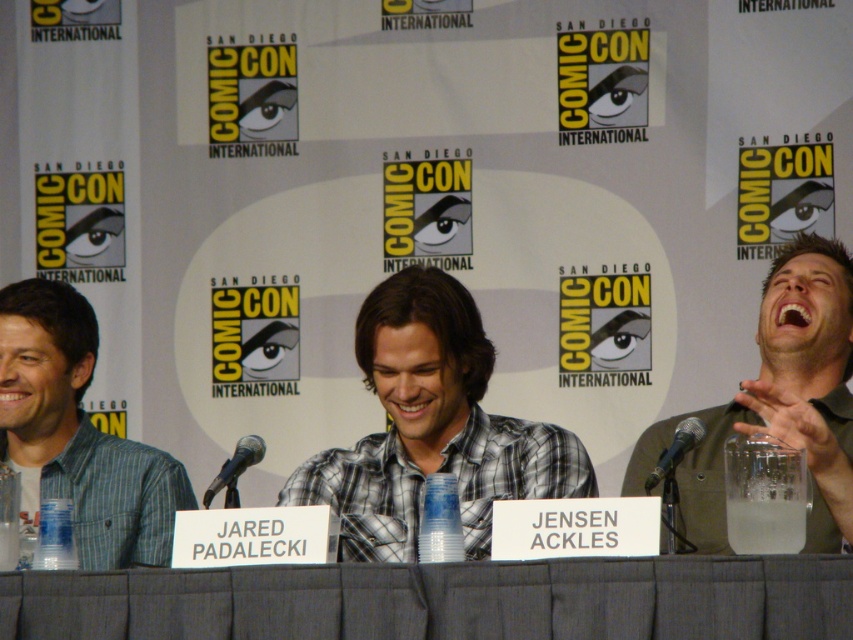
You are attending a panel discussion at Comic Con and see the point marked at coordinates (431,428). What object is located at that point?

The point at coordinates (431,428) corresponds to the plaid cotton shirt at center.

What is the 2D coordinate of the gray fabric table at center?

The gray fabric table at center is located at the 2D coordinate point of [444,600].